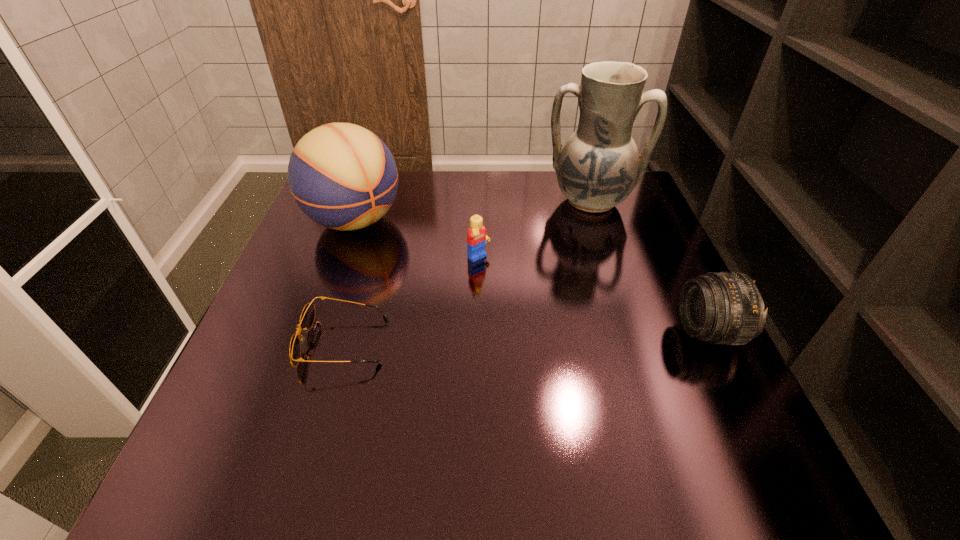
In the image, there is a desktop. Identify the location of free space at the right edge. (677, 295).

At what (x,y) coordinates should I click in order to perform the action: click on free region at the far right corner of the desktop. Please return your answer as a coordinate pair (x, y). Image resolution: width=960 pixels, height=540 pixels. Looking at the image, I should click on tap(613, 208).

Where is `free space at the near right corner`? The image size is (960, 540). free space at the near right corner is located at coordinates (723, 395).

This screenshot has height=540, width=960. I want to click on vacant point located between the pitcher and the second tallest object, so pos(472,211).

Locate an element on the screen. free space between the shortest object and the telephoto lens is located at coordinates (526, 338).

The height and width of the screenshot is (540, 960). I want to click on free spot between the tallest object and the Lego, so click(x=535, y=230).

Locate an element on the screen. The width and height of the screenshot is (960, 540). free space between the Lego and the pitcher is located at coordinates (535, 230).

Where is `vacant area that lies between the telephoto lens and the pitcher`? Image resolution: width=960 pixels, height=540 pixels. vacant area that lies between the telephoto lens and the pitcher is located at coordinates (649, 267).

At what (x,y) coordinates should I click in order to perform the action: click on vacant area that lies between the pitcher and the fourth shortest object. Please return your answer as a coordinate pair (x, y). This screenshot has width=960, height=540. Looking at the image, I should click on (472, 211).

I want to click on vacant area that lies between the tallest object and the basketball, so 472,211.